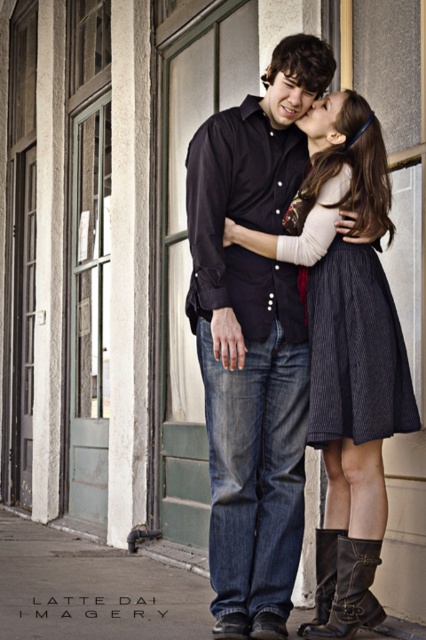
Who is positioned more to the right, matte black shirt at center or dark pinstriped skirt at center?

From the viewer's perspective, dark pinstriped skirt at center appears more on the right side.

Does matte black shirt at center come behind dark pinstriped skirt at center?

No, it is not.

Between point (294, 88) and point (310, 323), which one is positioned behind?

Positioned behind is point (310, 323).

The height and width of the screenshot is (640, 426). Identify the location of matte black shirt at center. (253, 339).

Who is higher up, matte black shirt at center or black leather boot at lower right?

matte black shirt at center is above.

Who is positioned more to the right, matte black shirt at center or black leather boot at lower right?

black leather boot at lower right is more to the right.

Does point (330, 67) come in front of point (331, 547)?

Yes.

Find the location of `matte black shirt at center`. matte black shirt at center is located at coordinates (253, 339).

Is point (242, 364) less distant than point (354, 625)?

No, it is behind (354, 625).

Can you confirm if matte black shirt at center is bigger than brown leather boot at lower center?

Yes.

Between point (279, 148) and point (342, 536), which one is positioned in front?

Point (342, 536) is in front.

Locate an element on the screen. This screenshot has width=426, height=640. matte black shirt at center is located at coordinates (253, 339).